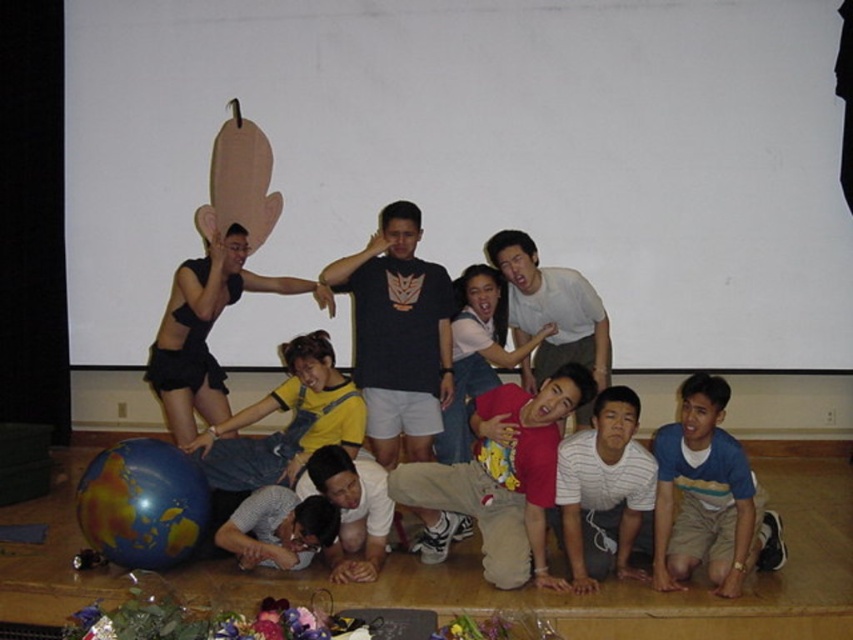
Question: Considering the real-world distances, which object is farthest from the denim overalls at center?

Choices:
 (A) multicolored glossy globe at lower left
 (B) matte red shirt at center
 (C) blue striped shirt at lower right

Answer: (C)

Question: Which point is farther to the camera?

Choices:
 (A) [698, 474]
 (B) [273, 289]
 (C) [160, 468]

Answer: (B)

Question: Which of the following is the closest to the observer?

Choices:
 (A) denim overalls at center
 (B) matte red shirt at center

Answer: (B)

Question: Is blue striped shirt at lower right to the right of denim overalls at center from the viewer's perspective?

Choices:
 (A) yes
 (B) no

Answer: (A)

Question: Does blue striped shirt at lower right appear on the right side of denim overalls at center?

Choices:
 (A) no
 (B) yes

Answer: (B)

Question: Does blue striped shirt at lower right have a greater width compared to multicolored glossy globe at lower left?

Choices:
 (A) no
 (B) yes

Answer: (B)